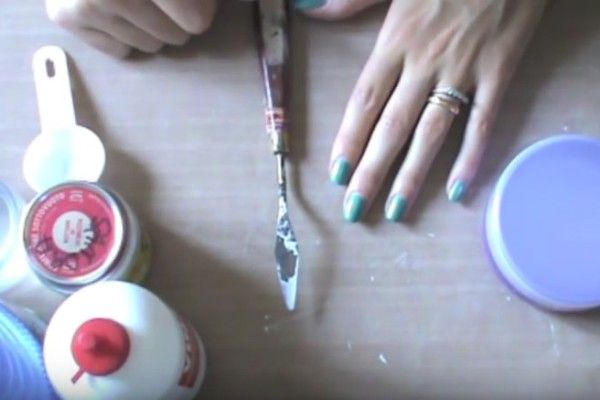
You are a GUI agent. You are given a task and a screenshot of the screen. Output one action in this format:
    pyautogui.click(x=<x>, y=<y>)
    Task: Click on the jar with lid
    The image size is (600, 400).
    Given the screenshot: What is the action you would take?
    pyautogui.click(x=74, y=226)